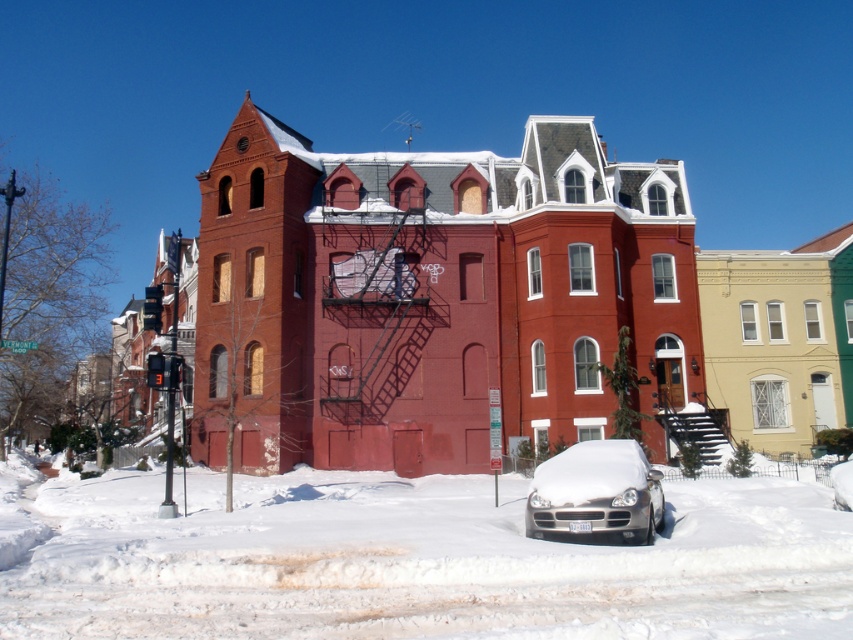
Question: Which point is closer to the camera?

Choices:
 (A) silver metallic car at lower center
 (B) white fluffy snow at center

Answer: (B)

Question: Does white fluffy snow at center have a lesser width compared to silver metallic car at lower center?

Choices:
 (A) no
 (B) yes

Answer: (A)

Question: Can you confirm if white fluffy snow at center is positioned above silver metallic car at lower center?

Choices:
 (A) yes
 (B) no

Answer: (B)

Question: Does white fluffy snow at center appear over silver metallic car at lower center?

Choices:
 (A) no
 (B) yes

Answer: (A)